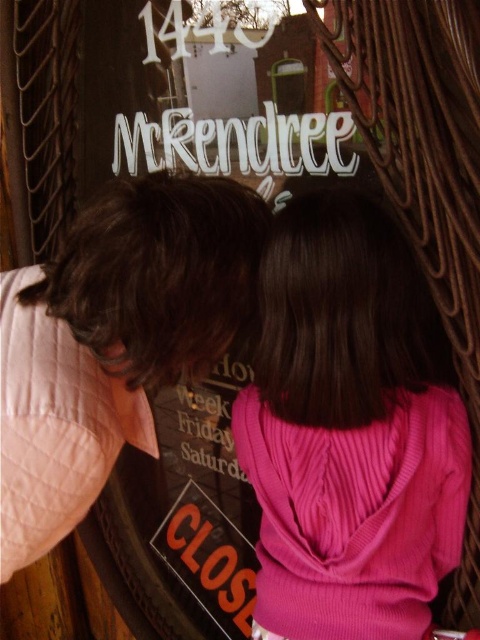
Question: Where is pink ribbed sweater at center located in relation to pink sweater at center in the image?

Choices:
 (A) right
 (B) left

Answer: (A)

Question: Can you confirm if pink ribbed sweater at center is wider than pink sweater at center?

Choices:
 (A) yes
 (B) no

Answer: (B)

Question: Which object appears closest to the camera in this image?

Choices:
 (A) pink sweater at center
 (B) pink ribbed sweater at center

Answer: (A)

Question: Which point is closer to the camera?

Choices:
 (A) pink ribbed sweater at center
 (B) pink sweater at center

Answer: (B)

Question: Among these objects, which one is farthest from the camera?

Choices:
 (A) pink ribbed sweater at center
 (B) pink sweater at center

Answer: (A)

Question: Can you confirm if pink ribbed sweater at center is positioned above pink sweater at center?

Choices:
 (A) no
 (B) yes

Answer: (A)